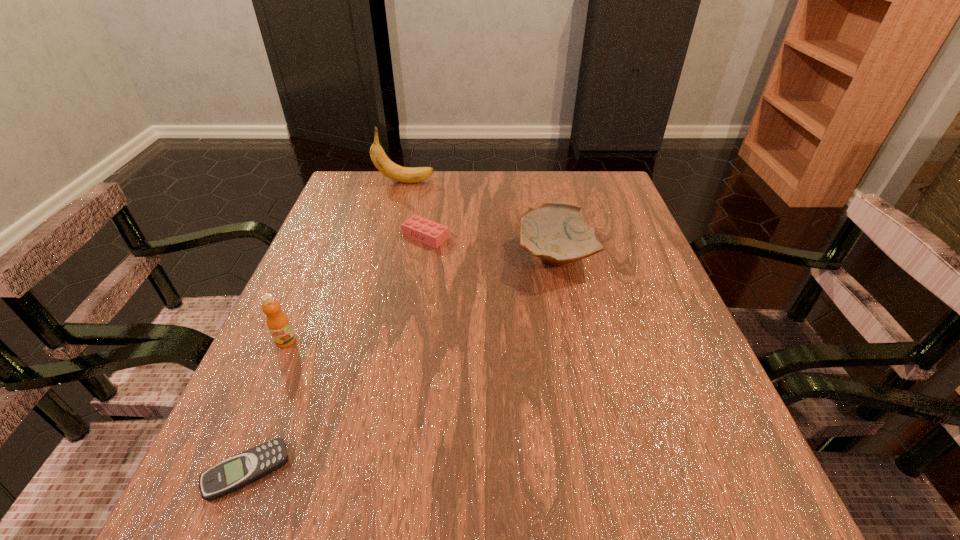
You are a GUI agent. You are given a task and a screenshot of the screen. Output one action in this format:
    pyautogui.click(x=<x>, y=<y>)
    Task: Click on the free space in the image that satisfies the following two spatial constraints: 1. on the front label of the shortest object; 2. on the left side of the second nearest object
    The height and width of the screenshot is (540, 960).
    Given the screenshot: What is the action you would take?
    pyautogui.click(x=229, y=471)

Where is `free space in the image that satisfies the following two spatial constraints: 1. at the start of the peel on the farthest object; 2. on the left side of the rightmost object`? The image size is (960, 540). free space in the image that satisfies the following two spatial constraints: 1. at the start of the peel on the farthest object; 2. on the left side of the rightmost object is located at coordinates (386, 256).